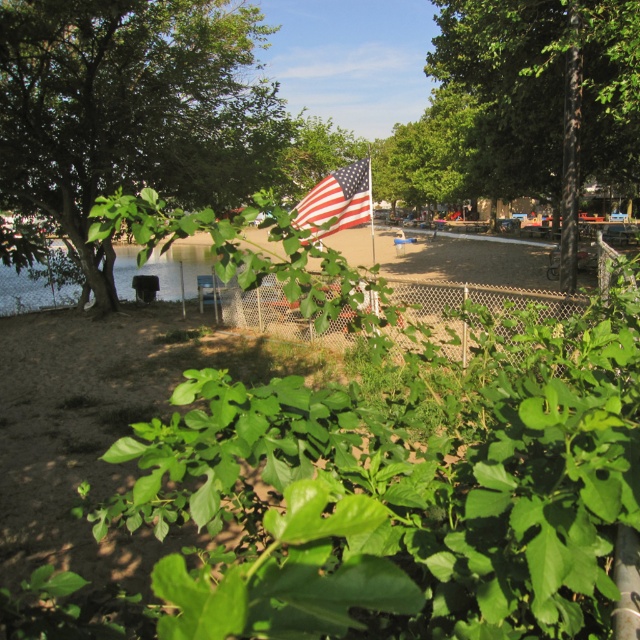
Describe the element at coordinates (545, 96) in the screenshot. I see `green leafy tree at center` at that location.

Find the location of a particular element. The image size is (640, 640). green leafy tree at center is located at coordinates (x=545, y=96).

Between point (621, 4) and point (268, 300), which one is positioned in front?

Point (621, 4) is in front.

I want to click on green leafy tree at center, so (x=545, y=96).

Who is more distant from viewer, (550, 310) or (300, 211)?

The point (300, 211) is behind.

You are a GUI agent. You are given a task and a screenshot of the screen. Output one action in this format:
    pyautogui.click(x=<x>, y=<y>)
    Task: Click on the metallic chain-link fence at center
    This screenshot has width=640, height=640.
    Given the screenshot: What is the action you would take?
    pyautogui.click(x=472, y=301)

Who is more forward, (580, 44) or (308, 225)?

Positioned in front is point (308, 225).

Does green leafy tree at center appear on the right side of american flag at center?

Correct, you'll find green leafy tree at center to the right of american flag at center.

Where is `green leafy tree at center`? green leafy tree at center is located at coordinates (545, 96).